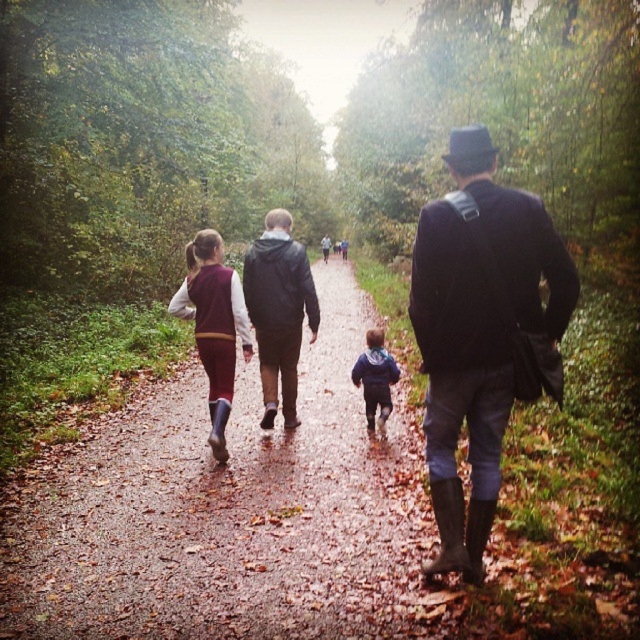
You are a photographer trying to capture a group photo of the blue fleece jacket at center and the dark blue jacket at center. Since your camera can only focus on one person at a time, which jacket should you focus on to ensure the subject takes up more of the frame?

The dark blue jacket at center occupies more space than the blue fleece jacket at center, so focusing on the dark blue jacket at center will ensure the subject takes up more of the frame.

Based on the photo, you are a photographer trying to capture a group photo of the leather jacket at center and the dark blue jacket at center. Which jacket should you focus on first if you want to ensure both are in frame without adjusting your camera angle?

You should focus on the leather jacket at center first because it is shorter than the dark blue jacket at center, allowing you to position it lower in the frame while still including the taller jacket.

You are a photographer trying to capture a clear shot of the leather jacket at center and the dark blue jacket at center. Since the path is narrow and muddy, you need to position yourself carefully. Which jacket should you focus on first to ensure it doesn not get obscured by the other?

The leather jacket at center is located below the dark blue jacket at center, so you should focus on the dark blue jacket at center first to prevent it from blocking the view of the leather jacket at center.